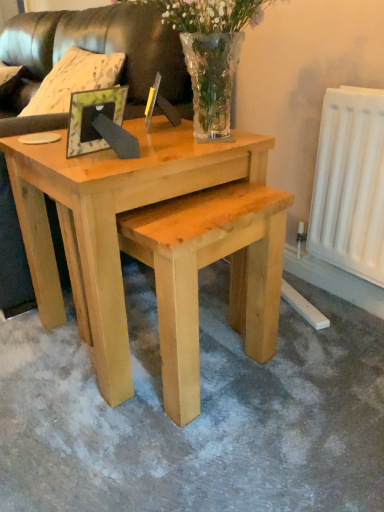
I want to click on free space to the right of green leafy frame at center, so click(x=179, y=154).